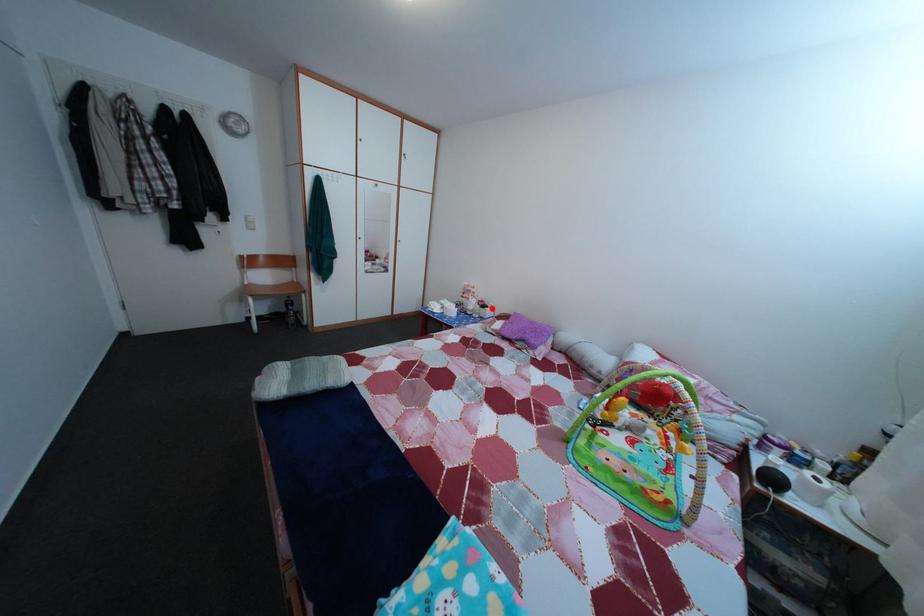
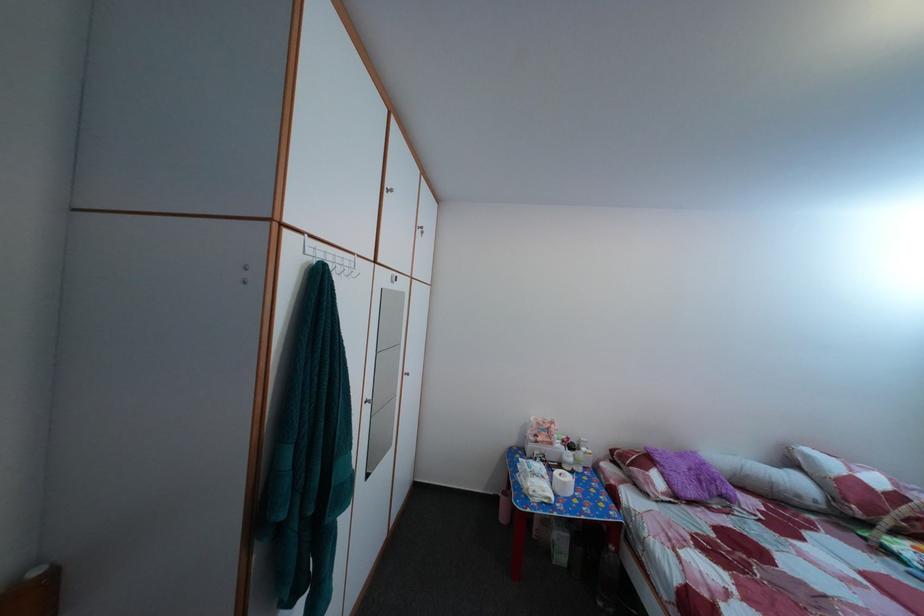
Question: I am providing you with two images of the same scene from different viewpoints. A red point is shown in image1. For the corresponding object point in image2, is it positioned nearer or farther from the camera?

Choices:
 (A) Nearer
 (B) Farther

Answer: (B)